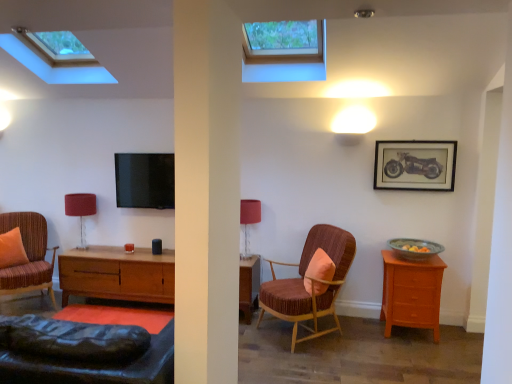
The width and height of the screenshot is (512, 384). Describe the element at coordinates (415, 165) in the screenshot. I see `wooden framed motorcycle print at upper right` at that location.

This screenshot has height=384, width=512. I want to click on striped fabric armchair at left, the first chair positioned from the left, so click(28, 255).

From a real-world perspective, who is located higher, wooden framed motorcycle print at upper right or matte red fabric lampshade at left, the second table lamp in the right-to-left sequence?

From a 3D spatial view, wooden framed motorcycle print at upper right is above.

Which of these two, wooden framed motorcycle print at upper right or matte red fabric lampshade at left, the second table lamp positioned from the front, is bigger?

matte red fabric lampshade at left, the second table lamp positioned from the front, is bigger.

From the image's perspective, is wooden framed motorcycle print at upper right positioned above or below matte red fabric lampshade at left, the second table lamp in the right-to-left sequence?

From the image's perspective, wooden framed motorcycle print at upper right appears above matte red fabric lampshade at left, the second table lamp in the right-to-left sequence.

Considering the relative positions of wooden framed motorcycle print at upper right and matte red fabric lampshade at left, which is the first table lamp from back to front, in the image provided, is wooden framed motorcycle print at upper right in front of matte red fabric lampshade at left, which is the first table lamp from back to front,?

Yes.

Could you tell me if matte red fabric lampshade at left, which is the first table lamp from back to front, is turned towards striped fabric armchair at left, marked as the second chair in a right-to-left arrangement?

Yes, matte red fabric lampshade at left, which is the first table lamp from back to front, is facing striped fabric armchair at left, marked as the second chair in a right-to-left arrangement.

Considering the points (68, 213) and (5, 215), which point is in front, point (68, 213) or point (5, 215)?

The point (5, 215) is more forward.

Looking at this image, considering the positions of objects matte red fabric lampshade at left, the second table lamp positioned from the front, and striped fabric armchair at left, the first chair positioned from the left, in the image provided, who is in front, matte red fabric lampshade at left, the second table lamp positioned from the front, or striped fabric armchair at left, the first chair positioned from the left,?

striped fabric armchair at left, the first chair positioned from the left, is more forward.

Considering the relative sizes of matte red fabric lampshade at left, which is the first table lamp from back to front, and striped fabric armchair at left, marked as the second chair in a right-to-left arrangement, in the image provided, is matte red fabric lampshade at left, which is the first table lamp from back to front, shorter than striped fabric armchair at left, marked as the second chair in a right-to-left arrangement,?

Yes.

From a real-world perspective, between transparent glass window at upper center, marked as the 1th window in a right-to-left arrangement, and transparent glass skylight at upper center, the 2th window when ordered from right to left, who is vertically lower?

From a 3D spatial view, transparent glass skylight at upper center, the 2th window when ordered from right to left, is below.

Which is more to the right, transparent glass window at upper center, marked as the 1th window in a right-to-left arrangement, or transparent glass skylight at upper center, the first window in the left-to-right sequence?

Positioned to the right is transparent glass window at upper center, marked as the 1th window in a right-to-left arrangement.

Considering the sizes of objects transparent glass window at upper center, the 2th window viewed from the left, and transparent glass skylight at upper center, the first window in the left-to-right sequence, in the image provided, who is taller, transparent glass window at upper center, the 2th window viewed from the left, or transparent glass skylight at upper center, the first window in the left-to-right sequence,?

transparent glass window at upper center, the 2th window viewed from the left, is taller.

Which is in front, transparent glass window at upper center, the 2th window viewed from the left, or transparent glass skylight at upper center, the 2th window when ordered from right to left?

transparent glass window at upper center, the 2th window viewed from the left.

Could you tell me if light brown wood nightstand at right is facing velvet-like brown armchair at center, which is the second chair in left-to-right order?

No, light brown wood nightstand at right is not facing towards velvet-like brown armchair at center, which is the second chair in left-to-right order.

Can you confirm if light brown wood nightstand at right is taller than velvet-like brown armchair at center, which is the second chair in left-to-right order?

No.

In the scene shown: From the image's perspective, which object appears higher, light brown wood nightstand at right or velvet-like brown armchair at center, the 1th chair viewed from the right?

velvet-like brown armchair at center, the 1th chair viewed from the right.

Who is more distant, light brown wood nightstand at right or velvet-like brown armchair at center, which is the second chair in left-to-right order?

light brown wood nightstand at right.

Is light brown wood nightstand at right positioned with its back to matte red fabric lampshade at left, which is the first table lamp from back to front?

light brown wood nightstand at right does not have its back to matte red fabric lampshade at left, which is the first table lamp from back to front.

Locate an element on the screen. The height and width of the screenshot is (384, 512). table lamp that is the 2nd object to the left of the light brown wood nightstand at right, starting at the anchor is located at coordinates (80, 211).

Looking at this image, from the image's perspective, is light brown wood nightstand at right below matte red fabric lampshade at left, the second table lamp positioned from the front?

Indeed, from the image's perspective, light brown wood nightstand at right is shown beneath matte red fabric lampshade at left, the second table lamp positioned from the front.

Between light brown wood nightstand at right and matte red fabric lampshade at left, the second table lamp in the right-to-left sequence, which one appears on the right side from the viewer's perspective?

Positioned to the right is light brown wood nightstand at right.

From the image's perspective, which one is positioned higher, velvet-like brown armchair at center, the 1th chair viewed from the right, or striped fabric armchair at left, marked as the second chair in a right-to-left arrangement?

striped fabric armchair at left, marked as the second chair in a right-to-left arrangement, is shown above in the image.

Is velvet-like brown armchair at center, the 1th chair viewed from the right, wider than striped fabric armchair at left, marked as the second chair in a right-to-left arrangement?

In fact, velvet-like brown armchair at center, the 1th chair viewed from the right, might be narrower than striped fabric armchair at left, marked as the second chair in a right-to-left arrangement.

Is velvet-like brown armchair at center, which is the second chair in left-to-right order, facing away from striped fabric armchair at left, the first chair positioned from the left?

No, velvet-like brown armchair at center, which is the second chair in left-to-right order,'s orientation is not away from striped fabric armchair at left, the first chair positioned from the left.

Does matte red fabric lampshade at left, arranged as the 1th table lamp when viewed from the left, appear on the right side of matte red table lamp at center, which appears as the 2th table lamp when viewed from the left?

No, matte red fabric lampshade at left, arranged as the 1th table lamp when viewed from the left, is not to the right of matte red table lamp at center, which appears as the 2th table lamp when viewed from the left.

Is matte red fabric lampshade at left, the second table lamp in the right-to-left sequence, facing towards matte red table lamp at center, the first table lamp from the right?

No, matte red fabric lampshade at left, the second table lamp in the right-to-left sequence, is not facing towards matte red table lamp at center, the first table lamp from the right.

From a real-world perspective, relative to matte red table lamp at center, positioned as the second table lamp in back-to-front order, is matte red fabric lampshade at left, the second table lamp in the right-to-left sequence, vertically above or below?

Clearly, from a real-world perspective, matte red fabric lampshade at left, the second table lamp in the right-to-left sequence, is below matte red table lamp at center, positioned as the second table lamp in back-to-front order.

At what (x,y) coordinates should I click in order to perform the action: click on table lamp located on the right of matte red fabric lampshade at left, which is the first table lamp from back to front. Please return your answer as a coordinate pair (x, y). This screenshot has height=384, width=512. Looking at the image, I should click on (249, 221).

This screenshot has height=384, width=512. Identify the location of the 2nd table lamp below the wooden framed motorcycle print at upper right (from a real-world perspective). (80, 211).

From the image's perspective, count 1st chairs downward from the matte red fabric lampshade at left, which is the first table lamp from back to front, and point to it. Please provide its 2D coordinates.

[(28, 255)]

Based on their spatial positions, is matte red fabric lampshade at left, the second table lamp positioned from the front, or wooden framed motorcycle print at upper right further from light brown wood nightstand at right?

matte red fabric lampshade at left, the second table lamp positioned from the front, lies further to light brown wood nightstand at right than the other object.

Considering their positions, is green glazed bowl at right positioned closer to orange fabric pillow at center, the first pillow in the right-to-left sequence, than matte red fabric lampshade at left, arranged as the 1th table lamp when viewed from the left?

Based on the image, green glazed bowl at right appears to be nearer to orange fabric pillow at center, the first pillow in the right-to-left sequence.

Estimate the real-world distances between objects in this image. Which object is further from matte red table lamp at center, the first table lamp from the right, striped fabric armchair at left, marked as the second chair in a right-to-left arrangement, or orange fabric pillow at left, the 1th pillow in the left-to-right sequence?

Among the two, orange fabric pillow at left, the 1th pillow in the left-to-right sequence, is located further to matte red table lamp at center, the first table lamp from the right.

From the image, which object appears to be farther from velvet-like brown armchair at center, the 1th chair viewed from the right, striped fabric armchair at left, marked as the second chair in a right-to-left arrangement, or orange fabric pillow at center, the 2th pillow when ordered from left to right?

striped fabric armchair at left, marked as the second chair in a right-to-left arrangement, is positioned further to the anchor velvet-like brown armchair at center, the 1th chair viewed from the right.

When comparing their distances from transparent glass skylight at upper center, the first window in the left-to-right sequence, does wooden framed motorcycle print at upper right or orange fabric pillow at left, marked as the 1th pillow in a back-to-front arrangement, seem closer?

orange fabric pillow at left, marked as the 1th pillow in a back-to-front arrangement, is positioned closer to the anchor transparent glass skylight at upper center, the first window in the left-to-right sequence.

Considering their positions, is transparent glass window at upper center, the 2th window viewed from the left, positioned further to light brown wood nightstand at right than matte red fabric lampshade at left, which is the first table lamp from back to front?

matte red fabric lampshade at left, which is the first table lamp from back to front.

From the image, which object appears to be nearer to transparent glass window at upper center, the 2th window viewed from the left, matte red fabric lampshade at left, arranged as the 1th table lamp when viewed from the left, or orange fabric pillow at left, marked as the 1th pillow in a back-to-front arrangement?

Among the two, matte red fabric lampshade at left, arranged as the 1th table lamp when viewed from the left, is located nearer to transparent glass window at upper center, the 2th window viewed from the left.

From the picture: When comparing their distances from orange fabric pillow at left, which is counted as the 2th pillow, starting from the right, does velvet-like brown armchair at center, which is the second chair in left-to-right order, or matte red fabric lampshade at left, which is the first table lamp from back to front, seem further?

The object further to orange fabric pillow at left, which is counted as the 2th pillow, starting from the right, is velvet-like brown armchair at center, which is the second chair in left-to-right order.

Locate an element on the screen. window located between orange fabric pillow at left, which is counted as the 2th pillow, starting from the right, and transparent glass window at upper center, marked as the 1th window in a right-to-left arrangement, in the left-right direction is located at coordinates (54, 68).

Locate an element on the screen. picture frame that lies between transparent glass window at upper center, the 2th window viewed from the left, and green glazed bowl at right from top to bottom is located at coordinates (415, 165).

Where is `window between transparent glass skylight at upper center, the 2th window when ordered from right to left, and velvet-like brown armchair at center, which is the second chair in left-to-right order, vertically`? window between transparent glass skylight at upper center, the 2th window when ordered from right to left, and velvet-like brown armchair at center, which is the second chair in left-to-right order, vertically is located at coordinates (283, 42).

Locate an element on the screen. Image resolution: width=512 pixels, height=384 pixels. nightstand between orange fabric pillow at left, the 1th pillow in the left-to-right sequence, and wooden framed motorcycle print at upper right from left to right is located at coordinates (411, 293).